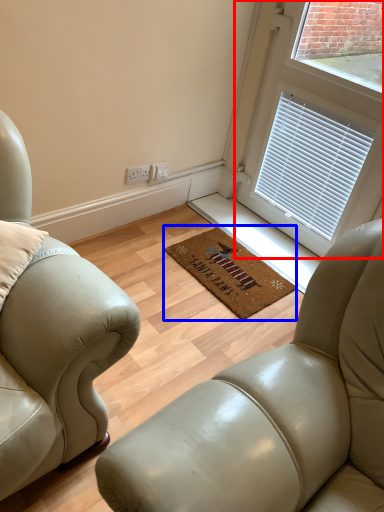
Question: Which object is closer to the camera taking this photo, window (highlighted by a red box) or mat (highlighted by a blue box)?

Choices:
 (A) window
 (B) mat

Answer: (A)